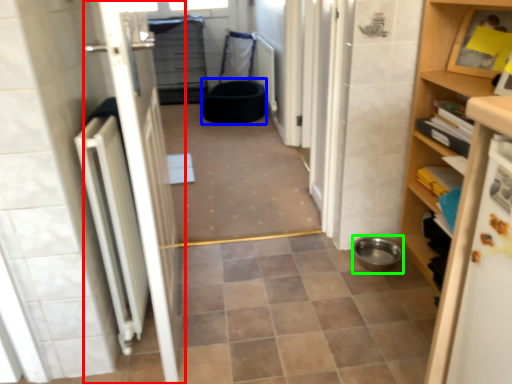
Question: Estimate the real-world distances between objects in this image. Which object is closer to door (highlighted by a red box), toilet bowl (highlighted by a blue box) or toilet bowl (highlighted by a green box)?

Choices:
 (A) toilet bowl
 (B) toilet bowl

Answer: (B)